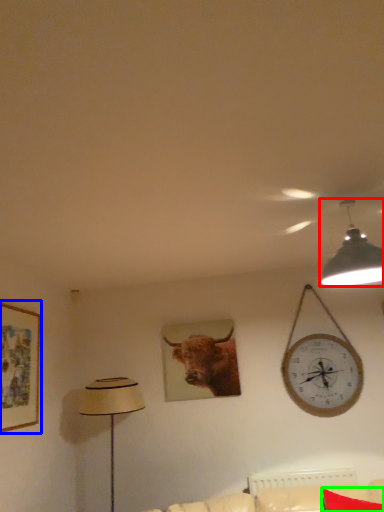
Question: Based on their relative distances, which object is nearer to lamp (highlighted by a red box)? Choose from picture frame (highlighted by a blue box) and pillow (highlighted by a green box).

Choices:
 (A) picture frame
 (B) pillow

Answer: (B)